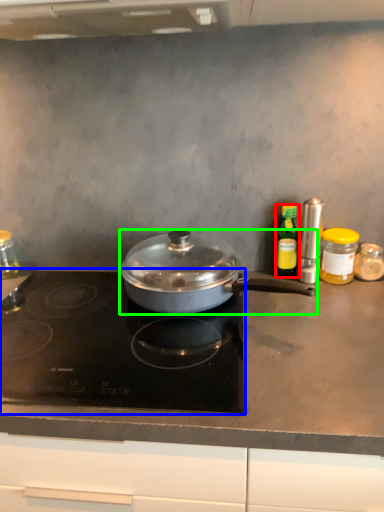
Question: Based on their relative distances, which object is nearer to kitchen appliance (highlighted by a red box)? Choose from gas stove (highlighted by a blue box) and kitchen appliance (highlighted by a green box).

Choices:
 (A) gas stove
 (B) kitchen appliance

Answer: (B)